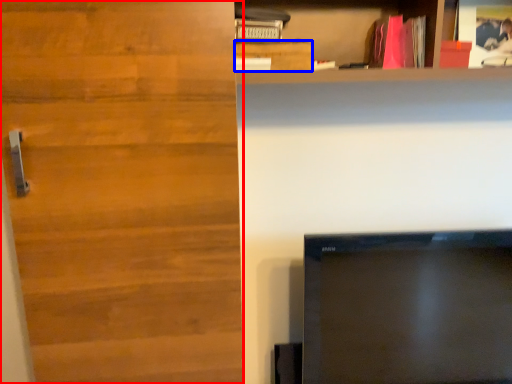
Question: Which point is closer to the camera, door (highlighted by a red box) or cabinetry (highlighted by a blue box)?

Choices:
 (A) door
 (B) cabinetry

Answer: (A)